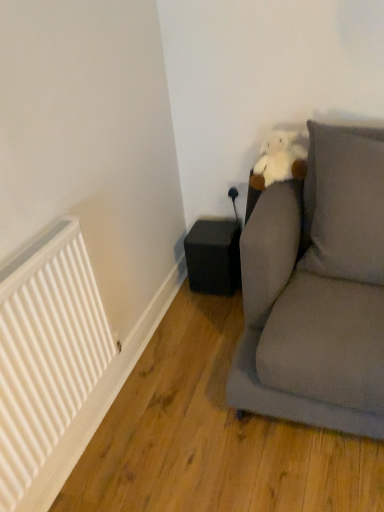
This screenshot has height=512, width=384. Find the location of `vacant space situated above black matte speaker at lower center (from a real-world perspective)`. vacant space situated above black matte speaker at lower center (from a real-world perspective) is located at coordinates (207, 229).